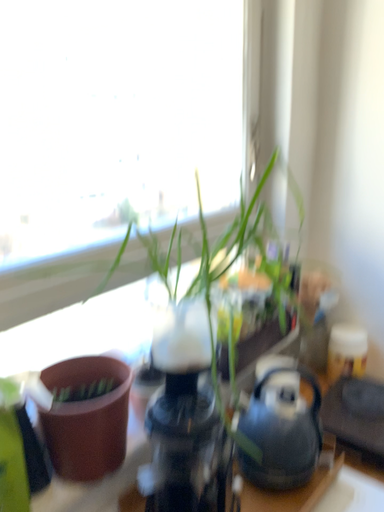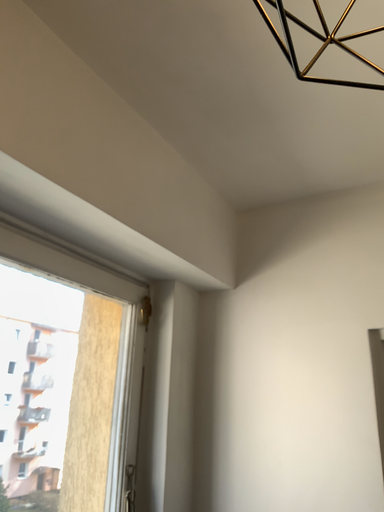
Question: How did the camera likely rotate when shooting the video?

Choices:
 (A) rotated upward
 (B) rotated downward

Answer: (A)